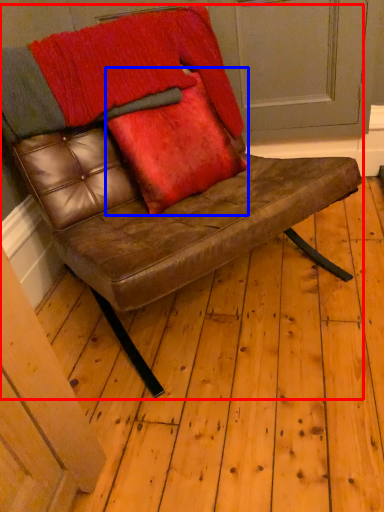
Question: Among these objects, which one is farthest to the camera, chair (highlighted by a red box) or throw pillow (highlighted by a blue box)?

Choices:
 (A) chair
 (B) throw pillow

Answer: (B)